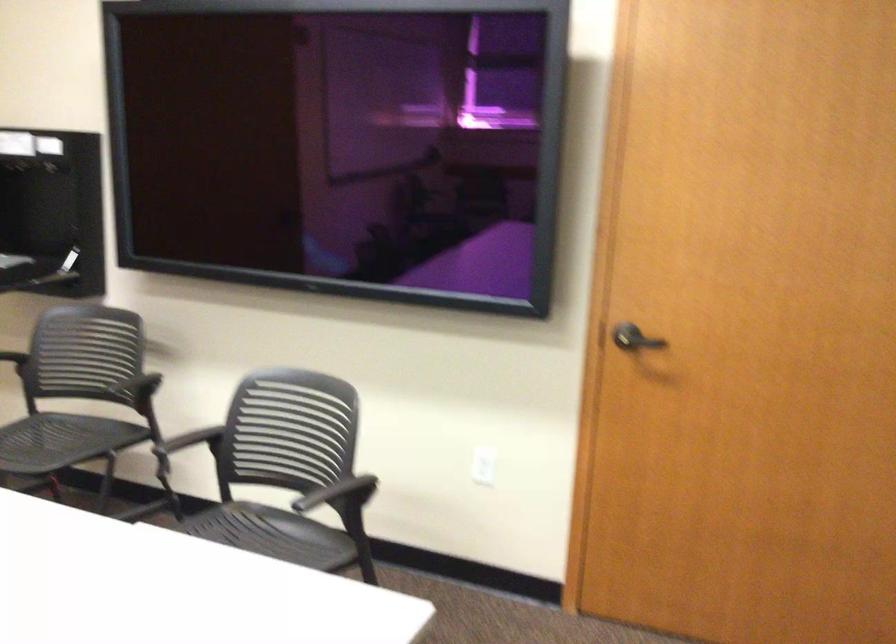
Describe the element at coordinates (634, 339) in the screenshot. I see `the black door handle` at that location.